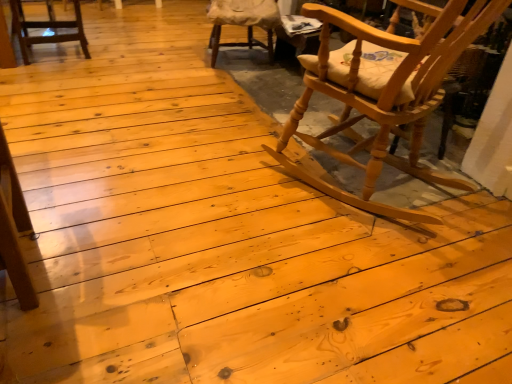
Where is `vacant space underneath matte wood chair at upper left, which is the 3th chair in right-to-left order (from a real-world perspective)`? This screenshot has height=384, width=512. vacant space underneath matte wood chair at upper left, which is the 3th chair in right-to-left order (from a real-world perspective) is located at coordinates (61, 56).